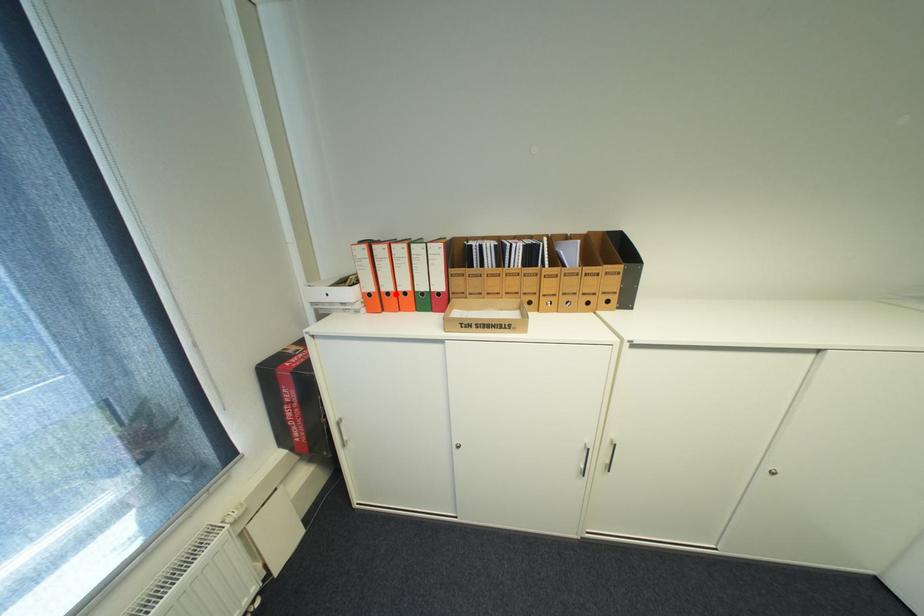
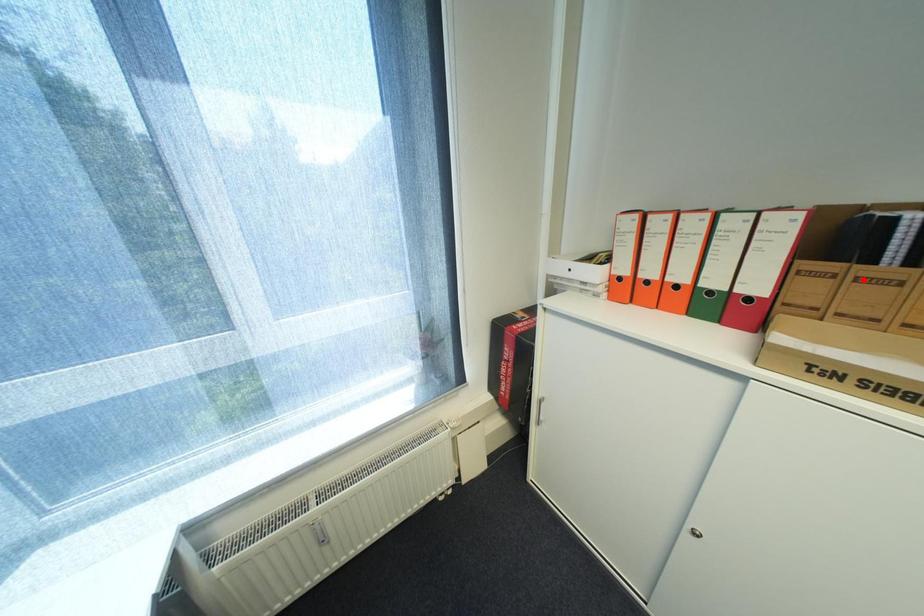
I am providing you with two images of the same scene from different viewpoints. A red point is marked on the first image and another point is marked on the second image. Do the highlighted points in image1 and image2 indicate the same real-world spot?

No